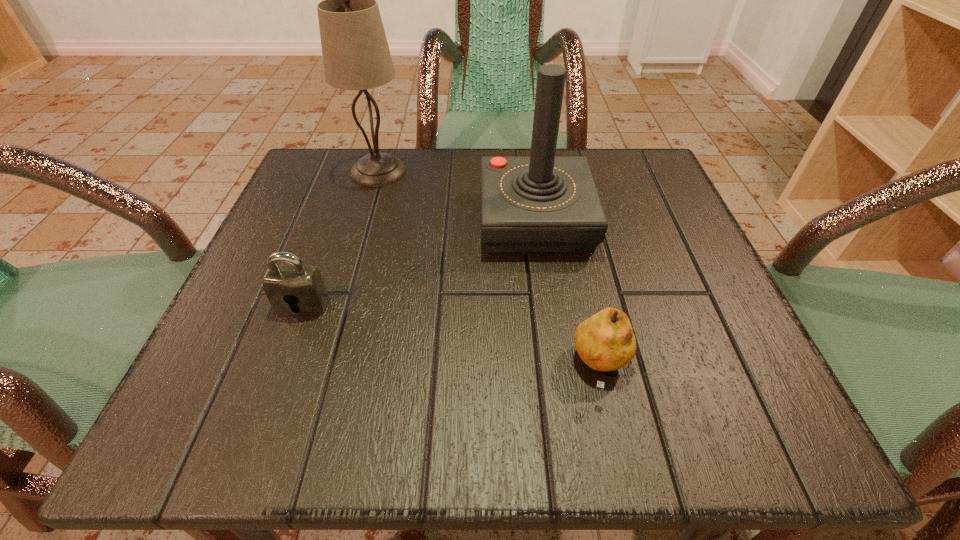
You are a GUI agent. You are given a task and a screenshot of the screen. Output one action in this format:
    pyautogui.click(x=<x>, y=<y>)
    Task: Click on the lampshade positioned at the far edge
    The width and height of the screenshot is (960, 540).
    Given the screenshot: What is the action you would take?
    pyautogui.click(x=356, y=56)

This screenshot has height=540, width=960. I want to click on joystick that is positioned at the far edge, so click(x=542, y=204).

Where is `object positioned at the near edge`? object positioned at the near edge is located at coordinates (605, 342).

Find the location of a particular element. The image size is (960, 540). lampshade that is at the left edge is located at coordinates (356, 56).

Identify the location of padlock located in the left edge section of the desktop. Image resolution: width=960 pixels, height=540 pixels. (302, 286).

You are a GUI agent. You are given a task and a screenshot of the screen. Output one action in this format:
    pyautogui.click(x=<x>, y=<y>)
    Task: Click on the object located at the far left corner
    
    Given the screenshot: What is the action you would take?
    pos(356,56)

The width and height of the screenshot is (960, 540). In the image, there is a desktop. What are the coordinates of `vacant space at the far edge` in the screenshot? It's located at (510, 150).

Locate an element on the screen. free space at the near edge of the desktop is located at coordinates (580, 434).

The image size is (960, 540). I want to click on free space at the left edge of the desktop, so click(327, 217).

Find the location of a particular element. Image resolution: width=960 pixels, height=540 pixels. free space at the right edge is located at coordinates (625, 281).